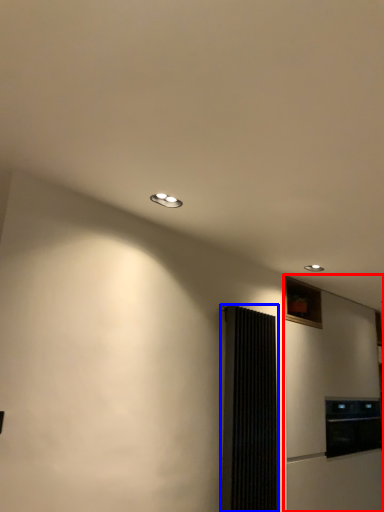
Question: Which point is closer to the camera, fridge (highlighted by a red box) or screen door (highlighted by a blue box)?

Choices:
 (A) fridge
 (B) screen door

Answer: (B)